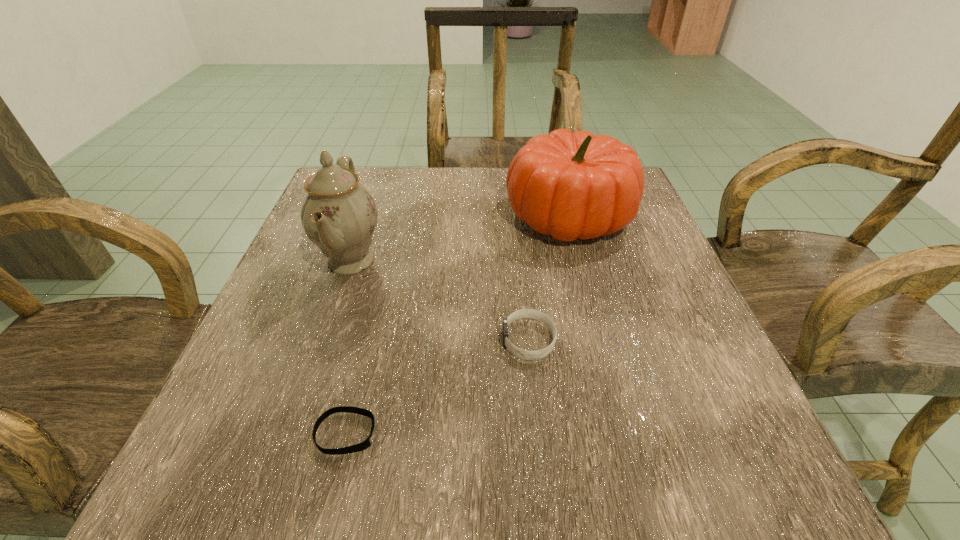
Where is `free space located 0.160m on the outer surface of the third tallest object`? Image resolution: width=960 pixels, height=540 pixels. free space located 0.160m on the outer surface of the third tallest object is located at coordinates (405, 340).

Locate an element on the screen. The height and width of the screenshot is (540, 960). vacant point located 0.300m on the display of the nearer wristband is located at coordinates (598, 433).

At what (x,y) coordinates should I click in order to perform the action: click on object located in the far edge section of the desktop. Please return your answer as a coordinate pair (x, y). This screenshot has width=960, height=540. Looking at the image, I should click on (568, 185).

Find the location of a particular element. The height and width of the screenshot is (540, 960). object present at the near edge is located at coordinates (365, 444).

At what (x,y) coordinates should I click in order to perform the action: click on chinaware positioned at the left edge. Please return your answer as a coordinate pair (x, y). Looking at the image, I should click on (338, 214).

You are a GUI agent. You are given a task and a screenshot of the screen. Output one action in this format:
    pyautogui.click(x=<x>, y=<y>)
    Task: Click on the wristband at the left edge
    
    Given the screenshot: What is the action you would take?
    pyautogui.click(x=365, y=444)

Identify the location of object present at the right edge. (568, 185).

Find the location of a particular element. object at the near left corner is located at coordinates (365, 444).

Identify the location of object located at the far right corner. (568, 185).

Image resolution: width=960 pixels, height=540 pixels. In order to click on blank space at the far edge in this screenshot , I will do `click(502, 185)`.